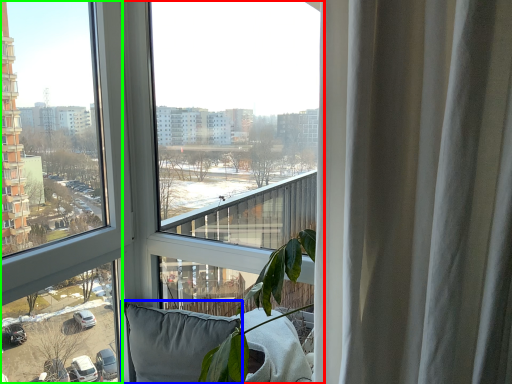
Question: Estimate the real-world distances between objects in this image. Which object is closer to window (highlighted by a red box), pillow (highlighted by a blue box) or window (highlighted by a green box)?

Choices:
 (A) pillow
 (B) window

Answer: (B)